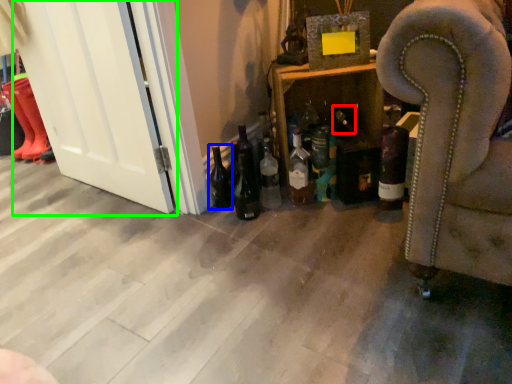
Question: Which object is positioned closest to bottle (highlighted by a red box)? Select from beer bottle (highlighted by a blue box) and screen door (highlighted by a green box).

Choices:
 (A) beer bottle
 (B) screen door

Answer: (A)